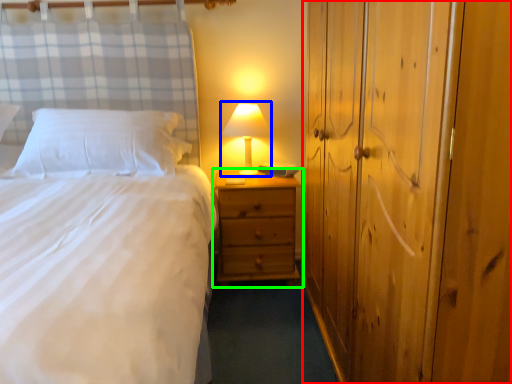
Question: Which is nearer to the dresser (highlighted by a red box)? table lamp (highlighted by a blue box) or nightstand (highlighted by a green box).

Choices:
 (A) table lamp
 (B) nightstand

Answer: (B)